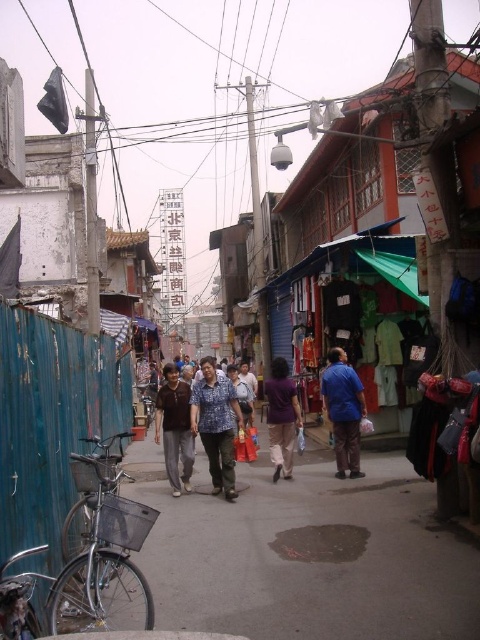
Question: Does blue printed shirt at center lie behind brown matte shirt at center?

Choices:
 (A) yes
 (B) no

Answer: (B)

Question: Can you confirm if blue matte shirt at center is bigger than purple matte shirt at center?

Choices:
 (A) yes
 (B) no

Answer: (A)

Question: Which point is closer to the camera taking this photo?

Choices:
 (A) (x=168, y=369)
 (B) (x=289, y=444)
 (C) (x=337, y=355)

Answer: (C)

Question: Which point appears farthest from the camera in this image?

Choices:
 (A) (179, 397)
 (B) (205, 564)
 (C) (287, 444)
 (D) (325, 376)

Answer: (C)

Question: Does gray concrete pavement at center come behind brown matte shirt at center?

Choices:
 (A) yes
 (B) no

Answer: (B)

Question: Which point appears closest to the camera in this image?

Choices:
 (A) (215, 448)
 (B) (286, 490)
 (C) (277, 470)
 (D) (177, 454)

Answer: (A)